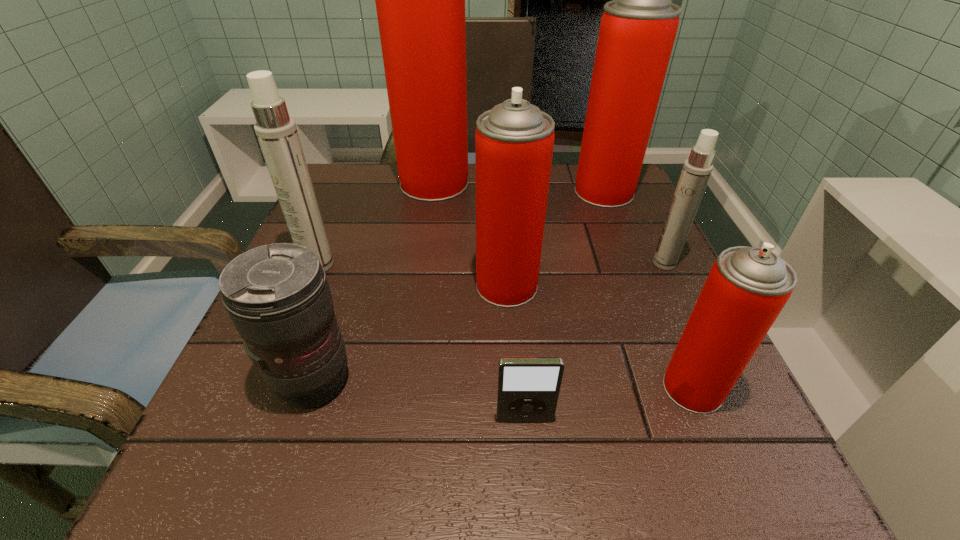
This screenshot has width=960, height=540. Find the location of `the second aerosol can from left to right`. the second aerosol can from left to right is located at coordinates pyautogui.click(x=420, y=0).

Where is `the leftmost red aerosol can`? the leftmost red aerosol can is located at coordinates (420, 0).

Where is `the second biggest red aerosol can`? the second biggest red aerosol can is located at coordinates (637, 31).

Locate an element on the screen. The image size is (960, 540). the seventh shortest object is located at coordinates (637, 31).

At what (x,y) coordinates should I click in order to perform the action: click on the third red aerosol can from right to left. Please return your answer as a coordinate pair (x, y). Looking at the image, I should click on (514, 141).

Find the location of a particular element. This screenshot has height=540, width=960. the second nearest red aerosol can is located at coordinates (514, 141).

The height and width of the screenshot is (540, 960). I want to click on the leftmost aerosol can, so click(x=277, y=133).

The image size is (960, 540). I want to click on the bigger white aerosol can, so click(277, 133).

The width and height of the screenshot is (960, 540). Identify the location of the right white aerosol can. (696, 171).

Identify the location of the nearest aerosol can. The image size is (960, 540). (747, 287).